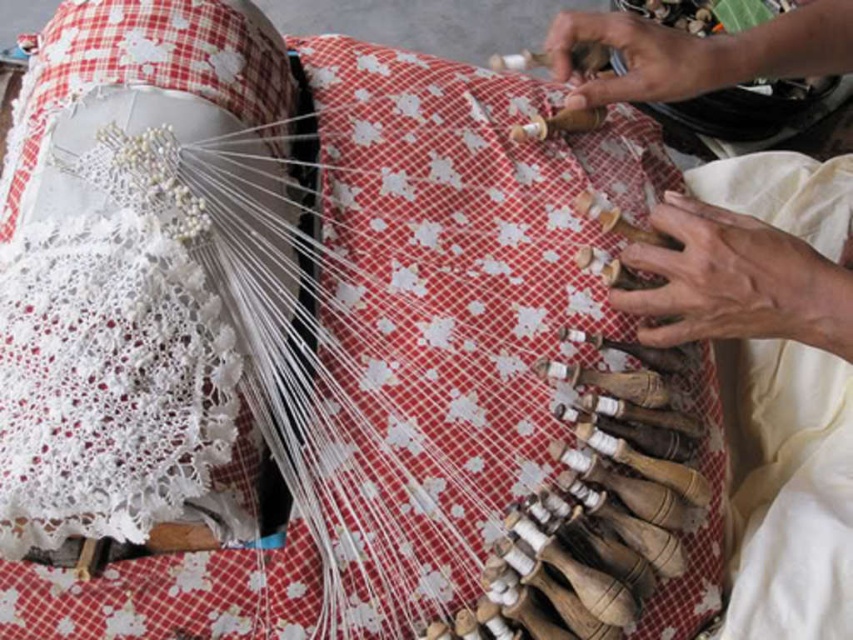
Question: Can you confirm if dry skin at center is positioned below smooth skin hand at upper right?

Choices:
 (A) no
 (B) yes

Answer: (B)

Question: Can you confirm if dry skin at center is positioned above smooth skin hand at upper right?

Choices:
 (A) no
 (B) yes

Answer: (A)

Question: Which of the following is the farthest from the observer?

Choices:
 (A) smooth skin hand at upper right
 (B) dry skin at center

Answer: (A)

Question: Which object appears farthest from the camera in this image?

Choices:
 (A) dry skin at center
 (B) smooth skin hand at upper right

Answer: (B)

Question: Is dry skin at center above smooth skin hand at upper right?

Choices:
 (A) no
 (B) yes

Answer: (A)